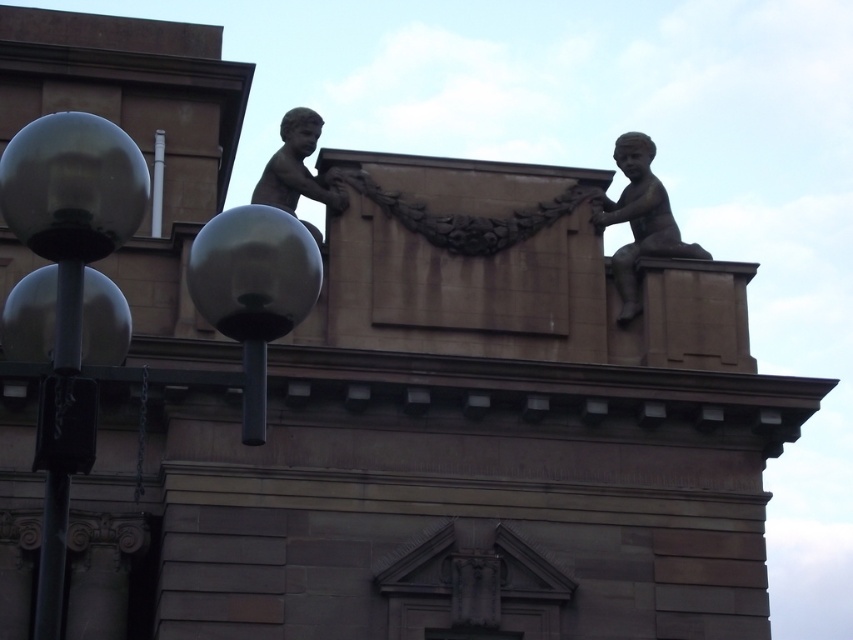
You are standing in front of the building and notice two points marked on the facade. The first point is at coordinates point (68, 358) and the second is at point (300, 172). Which point is closer to you?

Point (68, 358) is in front of point (300, 172), so it is closer to you.

You are an architect analyzing the building facade. You notice a point labeled as point (253, 289). What is the significance of this point on the building facade?

The point 0.458, 0.298 represents the matte black sphere at center, which is part of the modern streetlight with three spherical globes in the foreground of the building facade.

You are an architect assessing the streetlight in the image. The metallic gray sphere at left and the metallic gray pole at left are part of the streetlight. Which part of the streetlight has a greater width?

The metallic gray sphere at left has a greater width than the metallic gray pole at left.